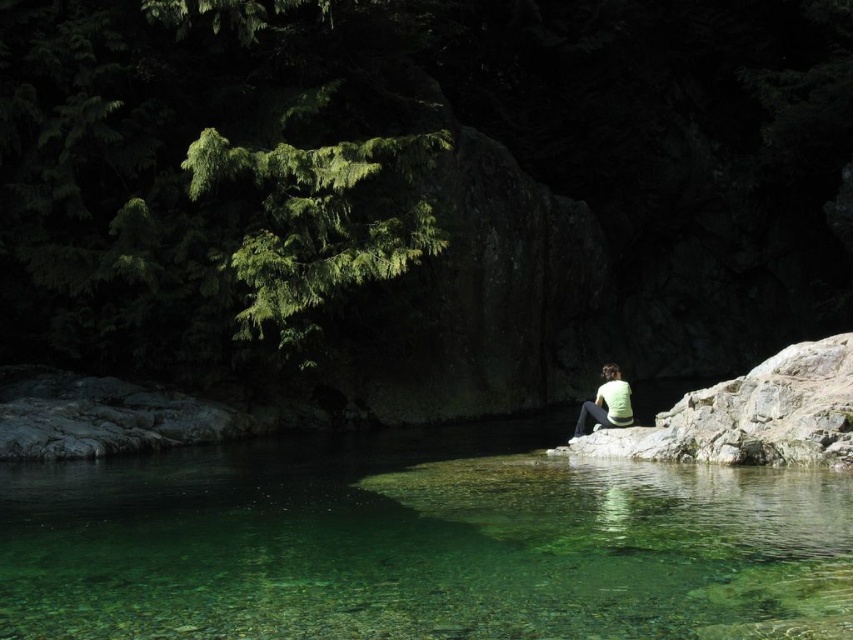
You are a photographer standing at the edge of the water. You want to capture both the clear glassy water at center and the green matte shirt at center in a single photo. Given that your camera has a maximum focus range of 20 feet, will you be able to focus on both subjects simultaneously?

The clear glassy water at center and the green matte shirt at center are 20.44 feet apart. Since the distance exceeds the camera maximum focus range of 20 feet, the photographer cannot focus on both subjects simultaneously.

You are standing at the edge of the water in the scene and want to reach both the point at coordinates point (343, 499) and point (601, 401). Which point will you reach first as you walk straight ahead?

Point (343, 499) is closer to the viewer than point (601, 401), so you will reach point (343, 499) first.

You are standing on the rocky outcrop where the person is sitting and want to reach the point marked as point (421, 544). Since this point is on clear glassy water at center, how would you describe the surface of the water at that location?

The surface of the water at point (421, 544) is clear and glassy, indicating it is smooth and reflective, likely due to the calm conditions described in the scene.